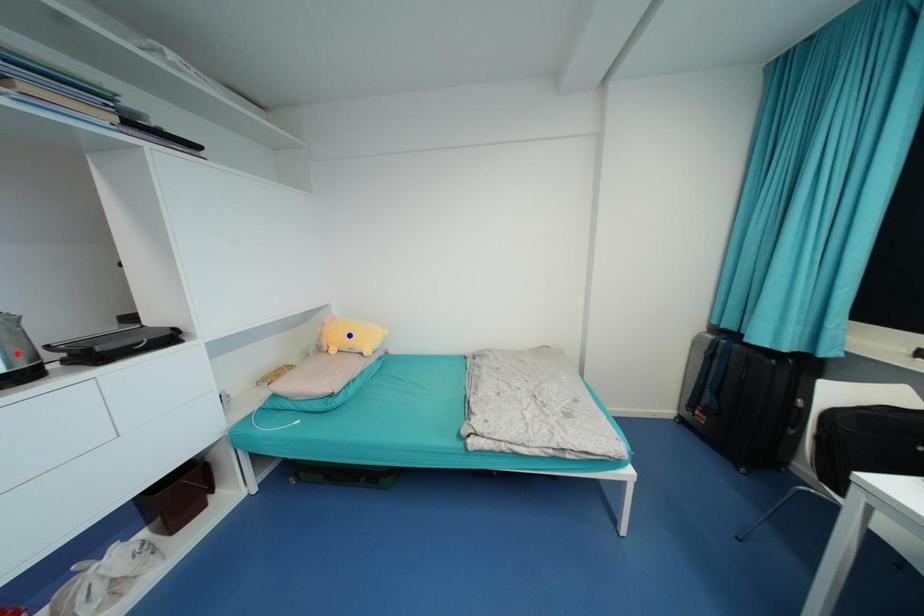
Question: Which of the two points in the image is closer to the camera?

Choices:
 (A) Blue point is closer.
 (B) Red point is closer.

Answer: (B)